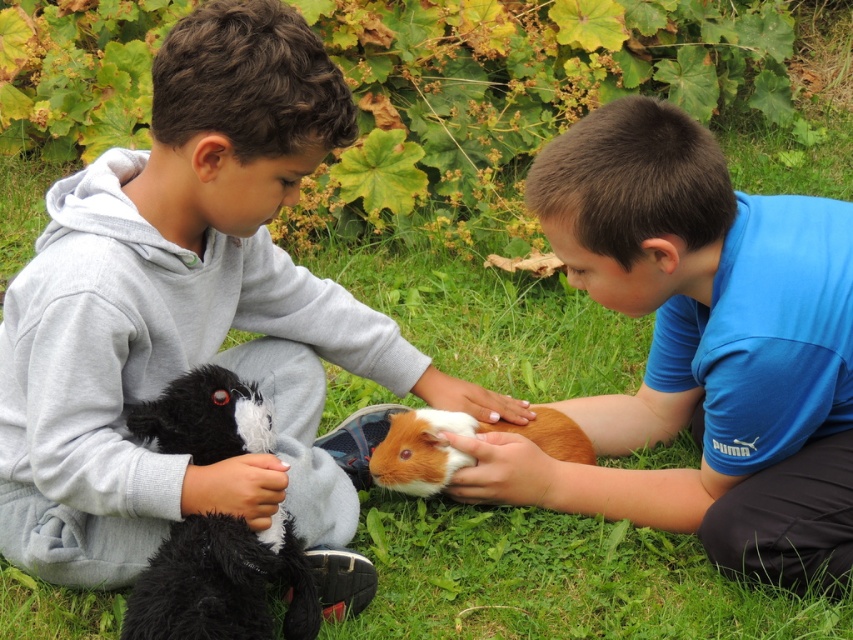
You are a photographer trying to capture the best angle of the scene. You have two points marked in the image at coordinates point (132, 252) and point (833, 484). Which point is better for a closeup shot if you want to focus on details closer to the viewer?

Point (132, 252) is closer to the viewer than point (833, 484), so it would be better for a closeup shot focusing on details closer to the viewer.

You are a photographer trying to capture a closeup shot of the blue cotton shirt at center and the black plush toy at left. Your camera can only focus on objects within a 60 cm range. Will both items be in focus?

The blue cotton shirt at center is 69.71 centimeters from the black plush toy at left, which exceeds the 60 cm focus range. Therefore, both items cannot be in focus simultaneously.

You are a photographer trying to capture a closeup shot of both the soft gray hoodie at center and the blue cotton shirt at center. Your camera has a minimum focus distance of 18 inches. Can you take the photo without moving either item?

The soft gray hoodie at center and blue cotton shirt at center are 20.05 inches apart, which is beyond the camera minimum focus distance of 18 inches. Therefore, the photographer can take the photo without moving either item.